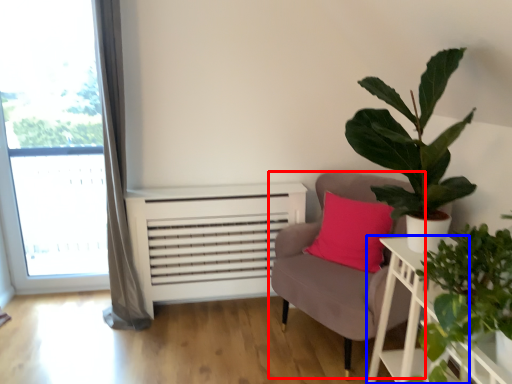
Question: Which object appears farthest to the camera in this image, chair (highlighted by a red box) or table (highlighted by a blue box)?

Choices:
 (A) chair
 (B) table

Answer: (A)